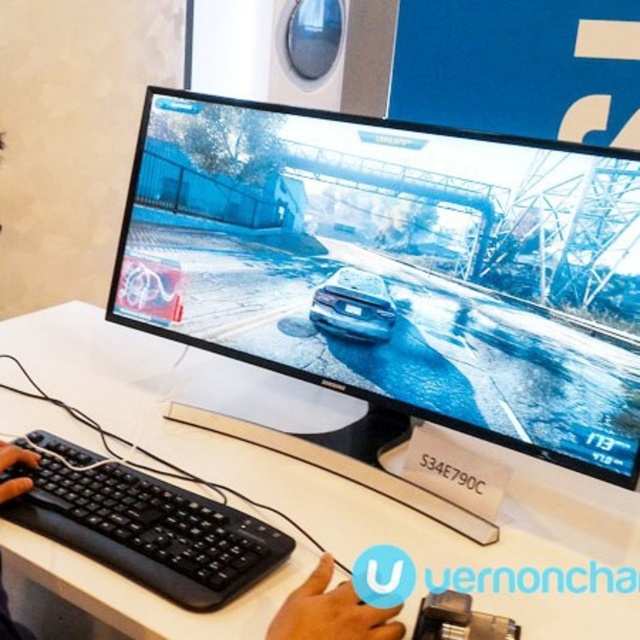
You are setting up a new monitor on your desk and want to ensure it fits properly. Given the desk and monitor described in the scene, will the satin black monitor at center fit horizontally on the white plastic computer desk at center without overhanging the edges?

The satin black monitor at center has a lesser width compared to the white plastic computer desk at center, so it should fit horizontally without overhanging the edges.

You are setting up a new computer desk and keyboard. Based on the image, can you determine if the white plastic computer desk at center will block the black plastic keyboard at lower left from being accessed?

The white plastic computer desk at center is positioned over the black plastic keyboard at lower left, so it would block access to the keyboard.

You are setting up a new monitor and need to place it on the desk. The monitor requires 1 meter of space to the left for ventilation. Given the current arrangement, will the white plastic computer desk at center allow enough space for the monitor to the left of the black plastic keyboard at lower left?

The white plastic computer desk at center is positioned on the right side of the black plastic keyboard at lower left, meaning there is sufficient space to the left of the keyboard for the monitor as long as the desk extends far enough. However, the description does not specify the desk length, so we can only confirm the relative position allows placement to the left of the keyboard.